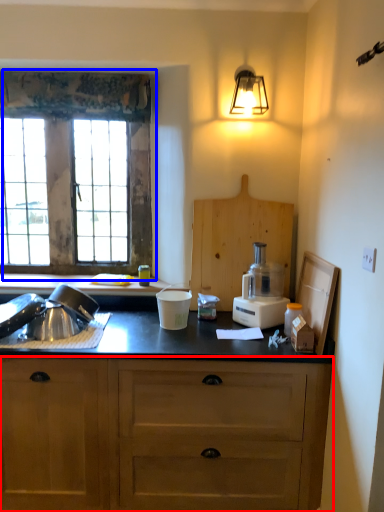
Question: Which object appears closest to the camera in this image, cabinetry (highlighted by a red box) or window (highlighted by a blue box)?

Choices:
 (A) cabinetry
 (B) window

Answer: (A)